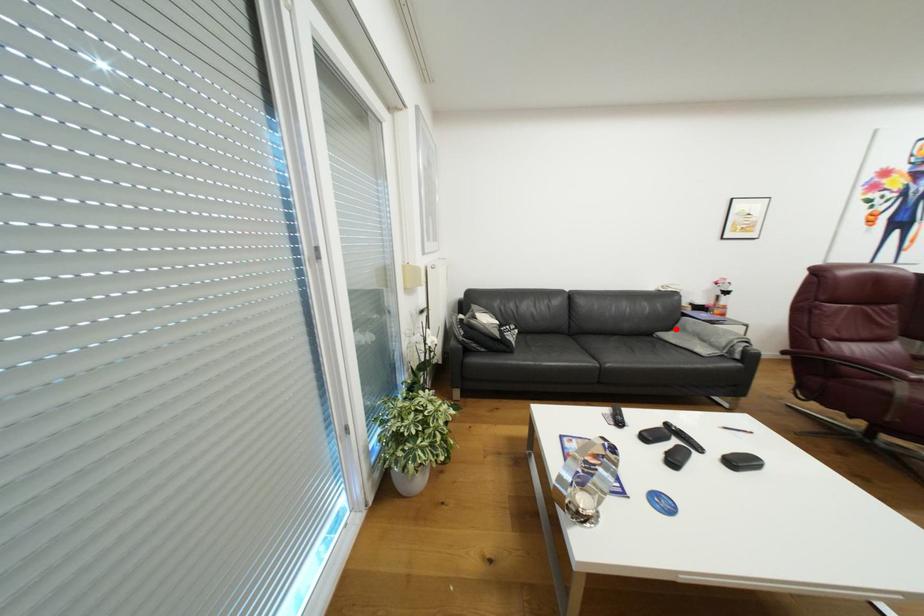
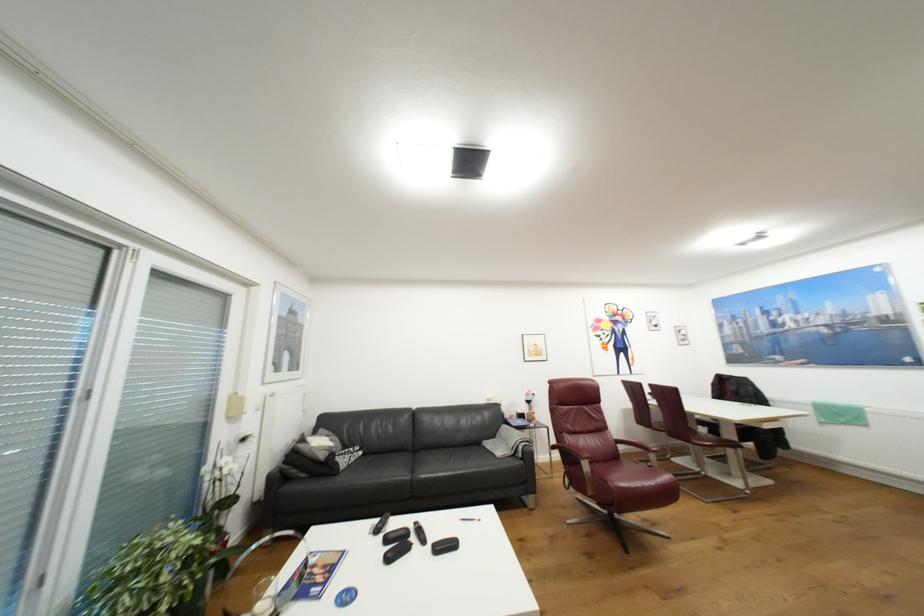
Question: I am providing you with two images of the same scene from different viewpoints. A red point is marked on the first image. Can you still see the location of the red point in image 2?

Choices:
 (A) Yes
 (B) No

Answer: (A)